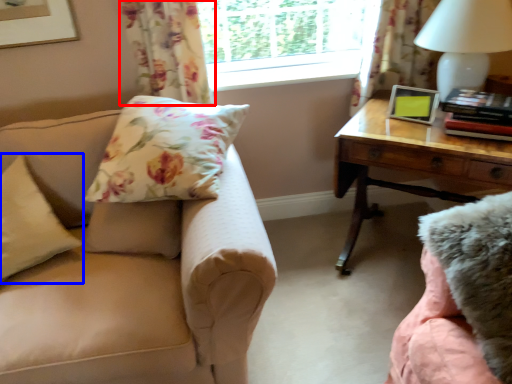
Question: Which of the following is the closest to the observer, curtain (highlighted by a red box) or pillow (highlighted by a blue box)?

Choices:
 (A) curtain
 (B) pillow

Answer: (B)